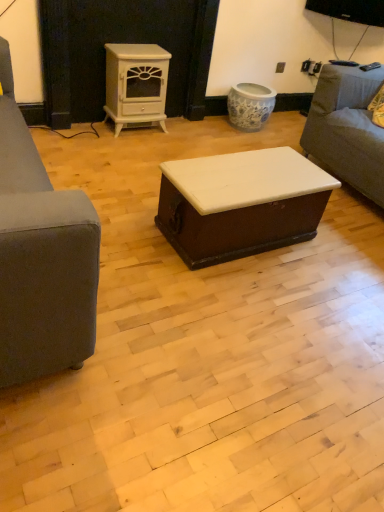
Locate an element on the screen. This screenshot has width=384, height=512. vacant area situated below white glossy wood stove at upper center (from a real-world perspective) is located at coordinates (148, 129).